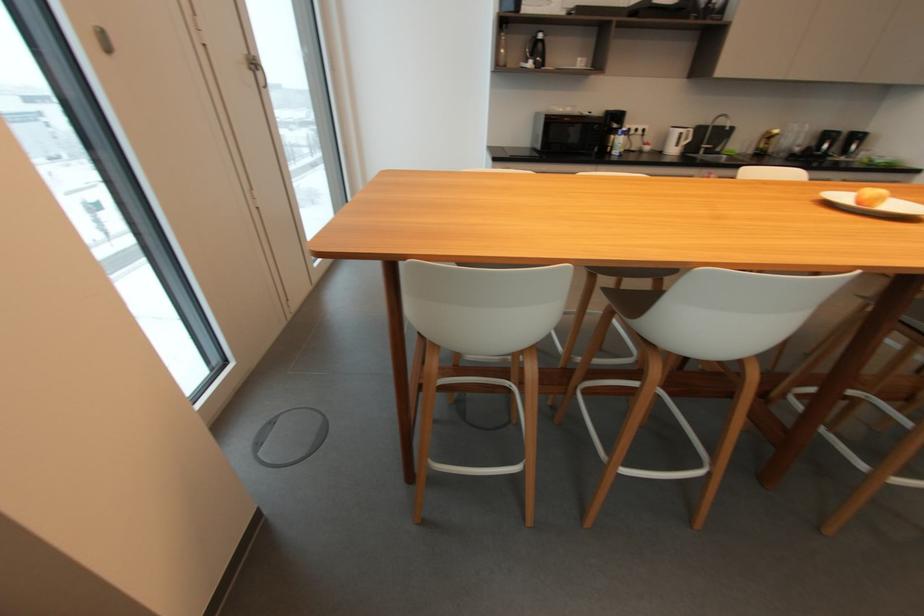
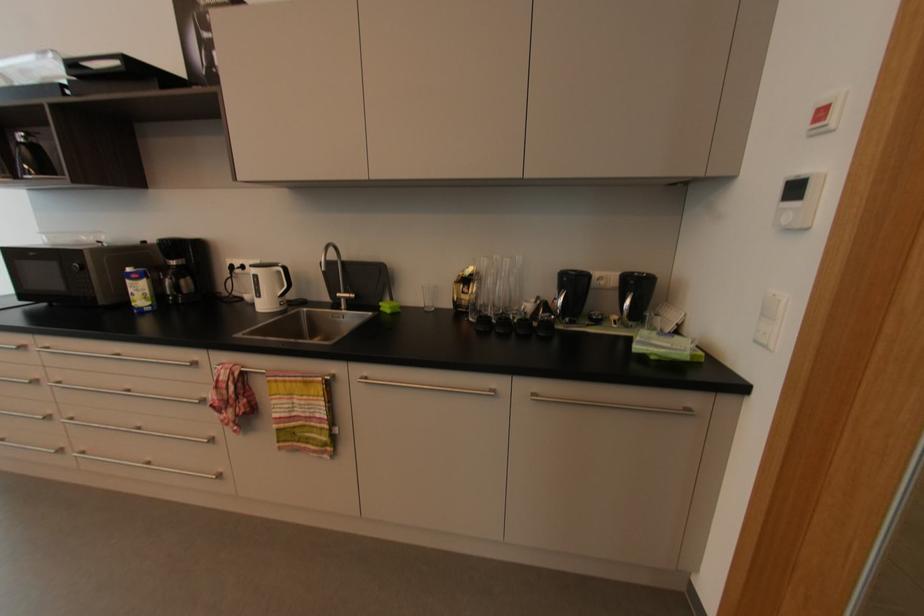
In the second image, find the point that corresponds to point 691,132 in the first image.

(282, 273)